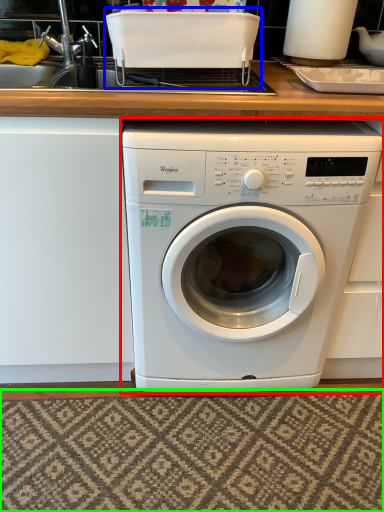
Question: Which object is positioned closest to washing machine (highlighted by a red box)? Select from appliance (highlighted by a blue box) and mat (highlighted by a green box).

Choices:
 (A) appliance
 (B) mat

Answer: (B)